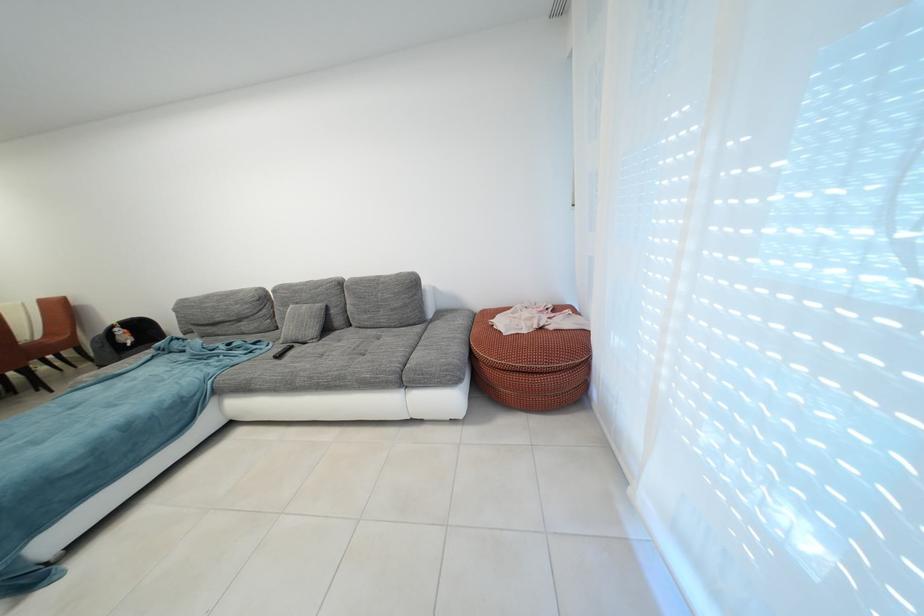
The width and height of the screenshot is (924, 616). I want to click on chair sitting surface, so click(x=52, y=344).